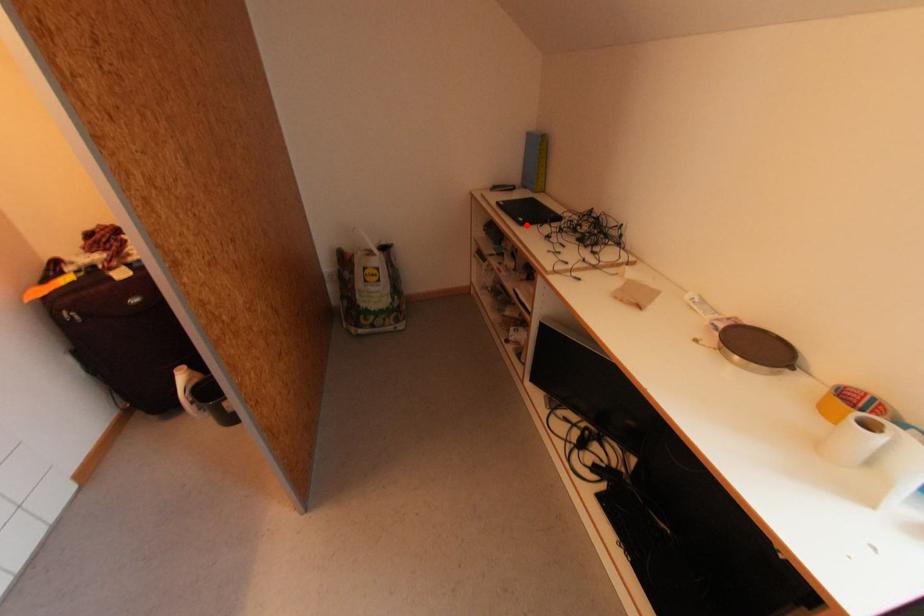
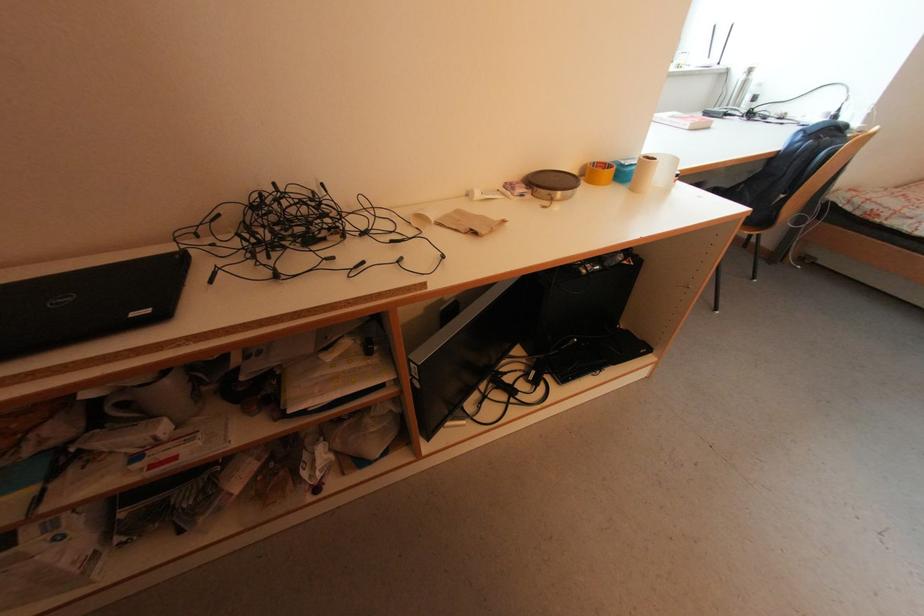
Question: I am providing you with two images of the same scene from different viewpoints. Image1 has a red point marked. In image2, the corresponding 3D location appears at what relative position? Reply with the corresponding letter.

Choices:
 (A) Closer
 (B) Farther

Answer: (B)